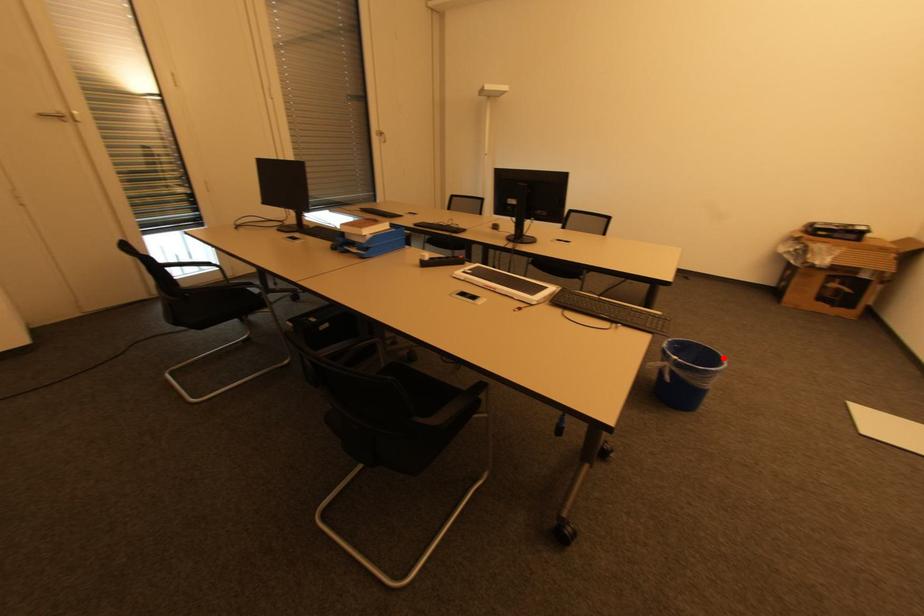
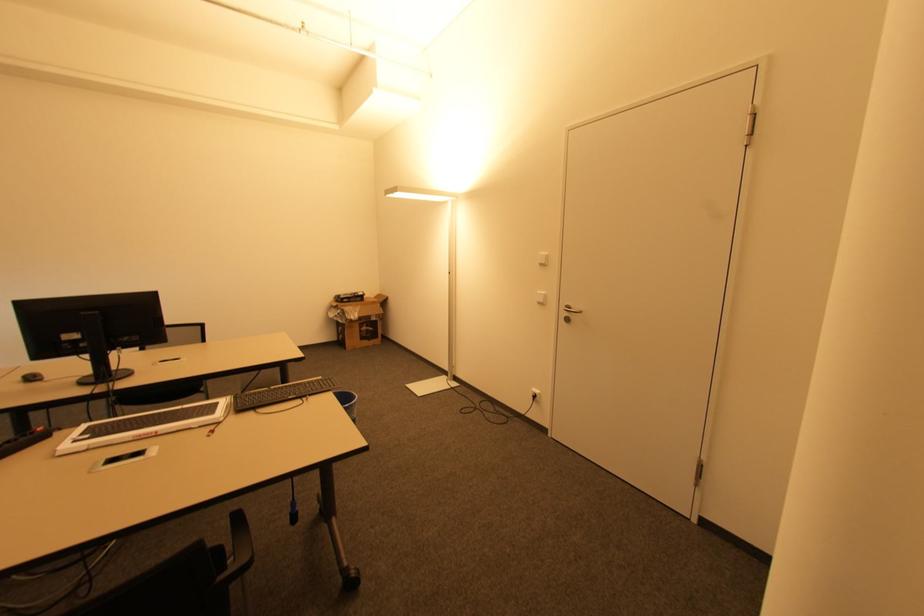
The point at the highlighted location is marked in the first image. Where is the corresponding point in the second image?

(353, 394)